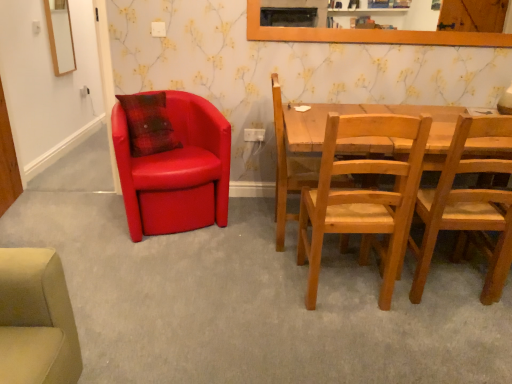
The height and width of the screenshot is (384, 512). I want to click on vacant space in front of natural wood chair at center, the 3th chair viewed from the left, so click(x=357, y=342).